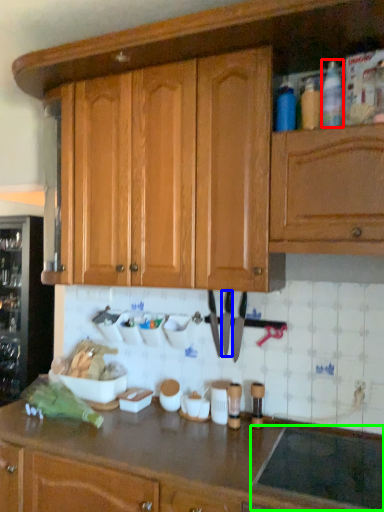
Question: Which object is positioned farthest from bottle (highlighted by a red box)? Select from knife (highlighted by a blue box) and appliance (highlighted by a green box).

Choices:
 (A) knife
 (B) appliance

Answer: (B)